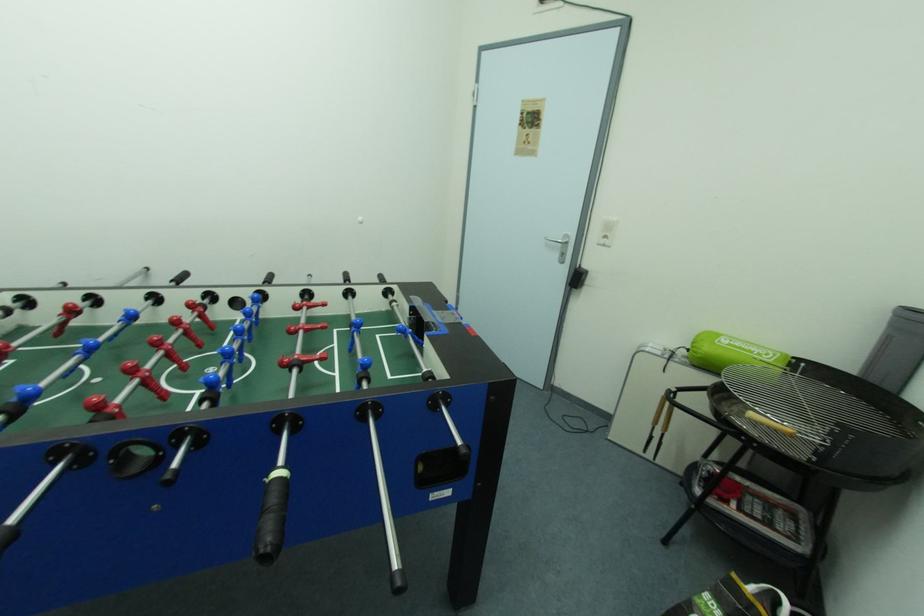
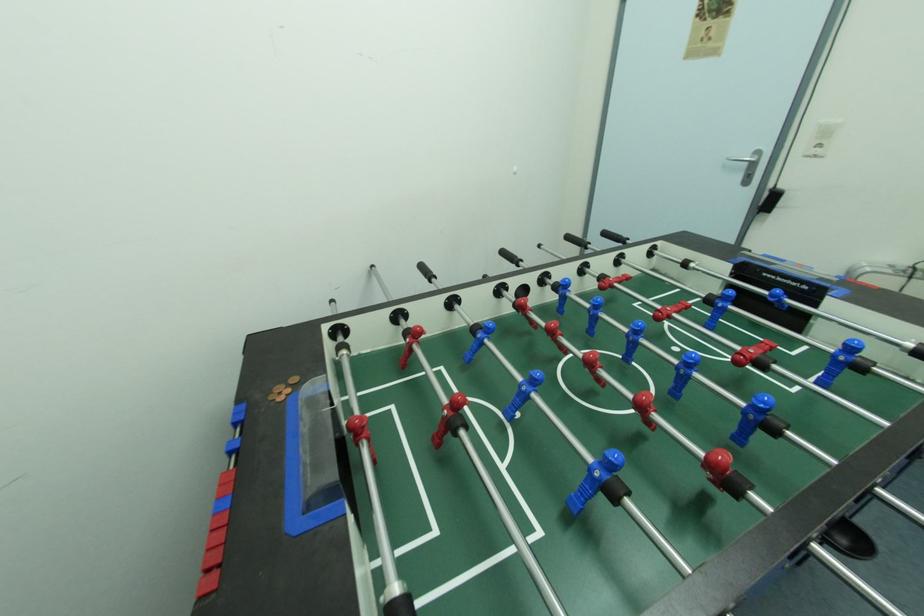
Question: Based on the continuous images, in which direction is the camera rotating? Reply with the corresponding letter.

Choices:
 (A) Left
 (B) Right
 (C) Up
 (D) Down

Answer: (D)